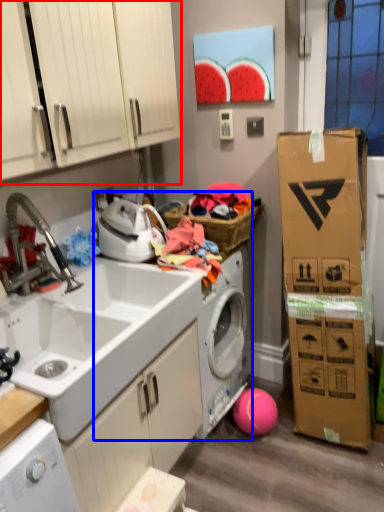
Question: Which of the following is the farthest to the observer, cabinetry (highlighted by a red box) or washing machine (highlighted by a blue box)?

Choices:
 (A) cabinetry
 (B) washing machine

Answer: (B)